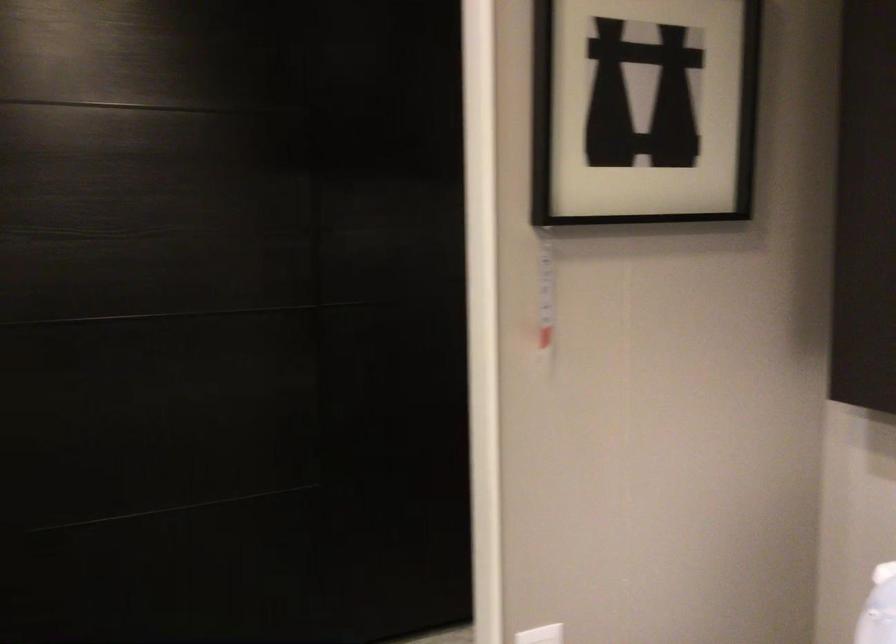
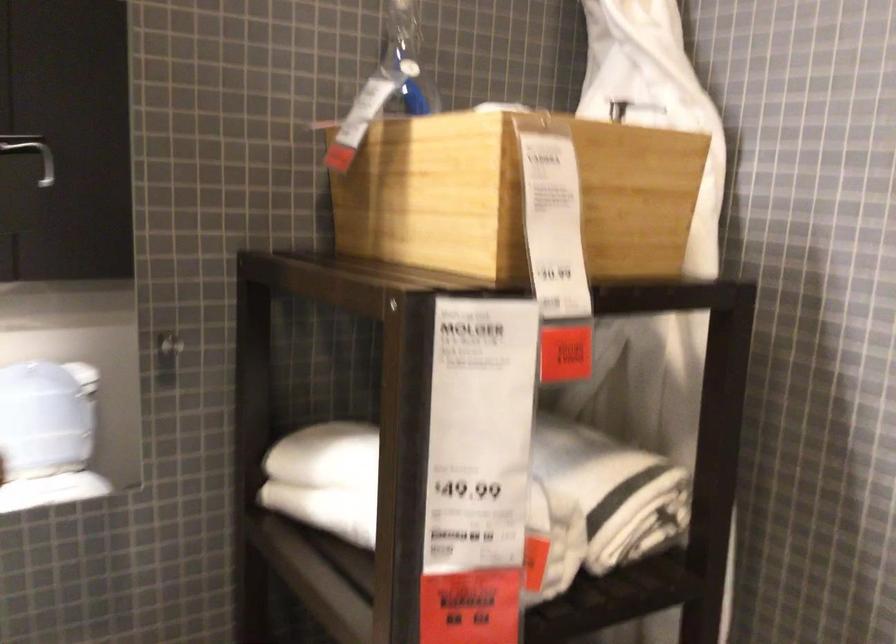
Question: The camera is either moving clockwise (left) or counter-clockwise (right) around the object. The first image is from the beginning of the video and the second image is from the end. Is the camera moving left or right when shooting the video?

Choices:
 (A) Left
 (B) Right

Answer: (B)